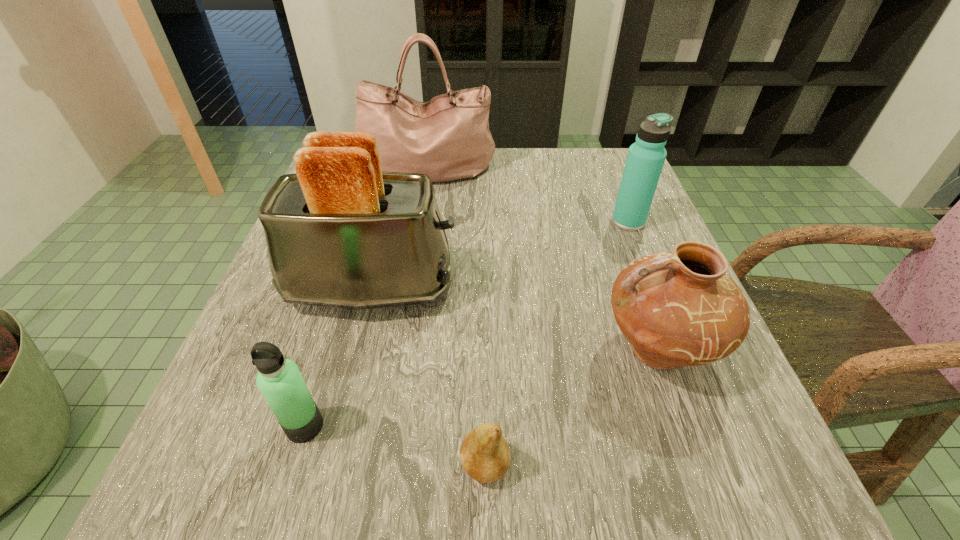
Identify the location of free space at the near right corner of the desktop. The width and height of the screenshot is (960, 540). (666, 447).

Where is `unoccupied area between the shorter thermos bottle and the pottery`? The height and width of the screenshot is (540, 960). unoccupied area between the shorter thermos bottle and the pottery is located at coordinates (481, 388).

Where is `vacant region between the handbag and the pear`? vacant region between the handbag and the pear is located at coordinates (456, 318).

Find the location of a particular element. The image size is (960, 540). vacant area between the nearer thermos bottle and the pear is located at coordinates (395, 446).

This screenshot has height=540, width=960. Identify the location of empty space that is in between the second farthest object and the farthest object. (528, 195).

The height and width of the screenshot is (540, 960). Identify the location of vacant space that's between the pear and the pottery. (571, 407).

At what (x,y) coordinates should I click in order to perform the action: click on free area in between the pottery and the toaster. Please return your answer as a coordinate pair (x, y). Image resolution: width=960 pixels, height=540 pixels. Looking at the image, I should click on (515, 319).

The width and height of the screenshot is (960, 540). I want to click on vacant area between the pear and the toaster, so click(x=428, y=376).

Where is `empty space between the shortest object and the right thermos bottle`? empty space between the shortest object and the right thermos bottle is located at coordinates (557, 343).

Find the location of a particular element. This screenshot has width=960, height=540. object that stands as the closest to the toaster is located at coordinates (279, 380).